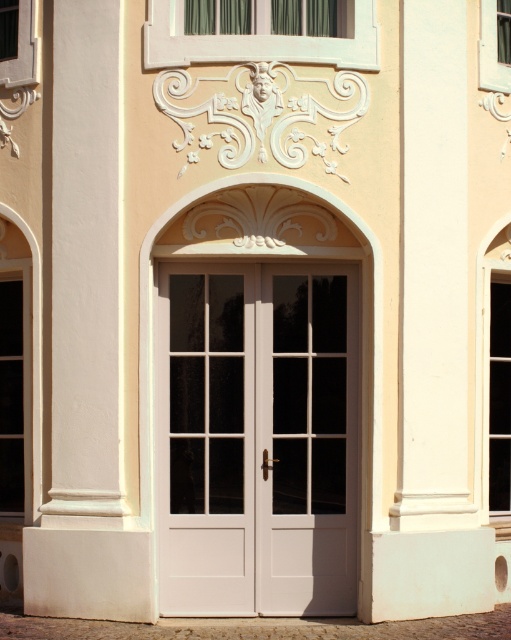
You are an architect designing a new building and want to ensure the doors and pillars align properly with the existing facade. Given the white wood door at center and the white smooth pillar at center, which one should you make wider to maintain symmetry?

The white wood door at center is larger in size than the white smooth pillar at center, so to maintain symmetry, the white smooth pillar at center should be made wider to match the size of the white wood door at center.